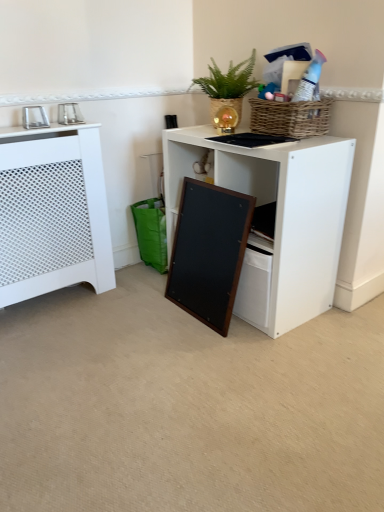
The height and width of the screenshot is (512, 384). In order to click on free space underneath white perforated radiator at left (from a real-world perspective) in this screenshot , I will do tap(48, 303).